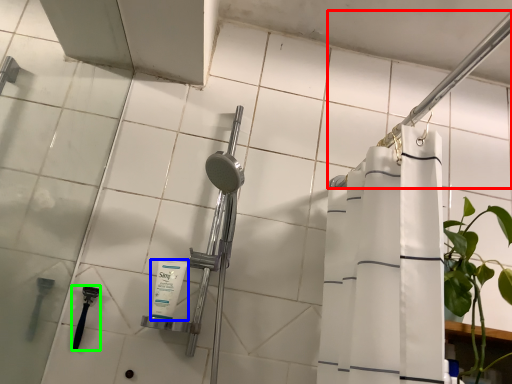
Question: Which is farther away from shower (highlighted by a red box)? toiletry (highlighted by a blue box) or shower (highlighted by a green box)?

Choices:
 (A) toiletry
 (B) shower

Answer: (B)